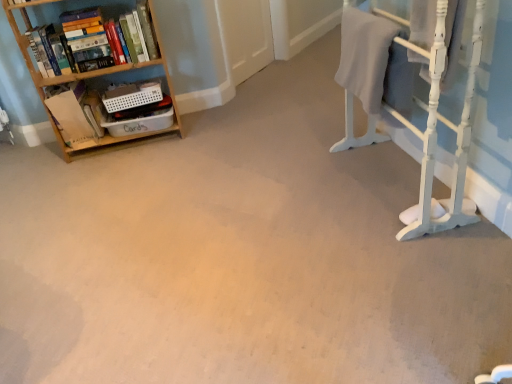
Identify the location of vacant space in front of white painted wood bunk bed at right. This screenshot has height=384, width=512. click(x=403, y=268).